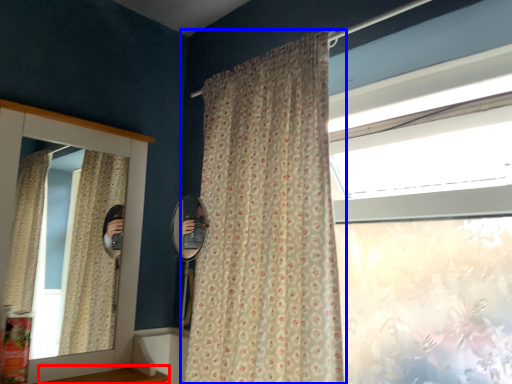
Question: Which object appears farthest to the camera in this image, window sill (highlighted by a red box) or curtain (highlighted by a blue box)?

Choices:
 (A) window sill
 (B) curtain

Answer: (A)